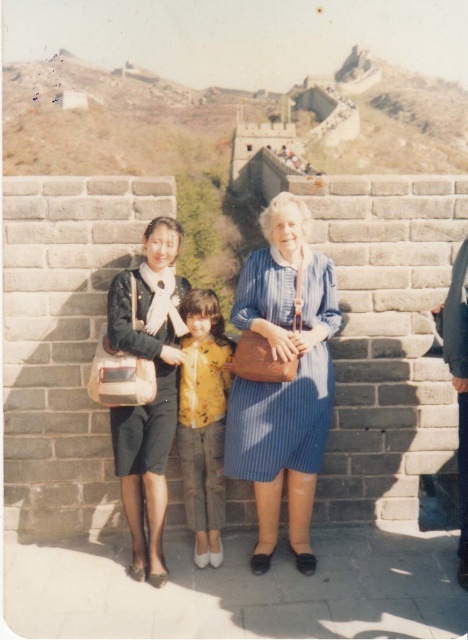
Locate an element on the screen. The width and height of the screenshot is (468, 640). matte blue dress at center is located at coordinates (155, 390).

Between point (166, 324) and point (190, 324), which one is positioned in front?

Positioned in front is point (166, 324).

Find the location of a particular element. The image size is (468, 640). matte blue dress at center is located at coordinates (155, 390).

Is point (315, 403) behind point (172, 428)?

No, (315, 403) is closer to viewer.

Where is `blue striped dress at center`? This screenshot has width=468, height=640. blue striped dress at center is located at coordinates (282, 376).

Between point (299, 387) and point (182, 304), which one is positioned behind?

The point (182, 304) is more distant.

From the picture: Who is more distant from viewer, [328,385] or [226,355]?

The point [226,355] is behind.

I want to click on blue striped dress at center, so click(282, 376).